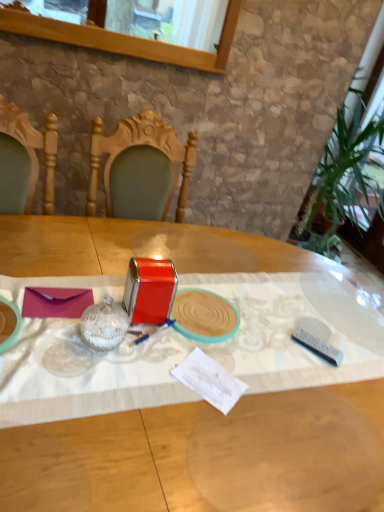
Identify the location of free area in between white plastic remote at lower right, the first tableware when ordered from right to left, and clear glass jar at center, acting as the 4th tableware starting from the right. (232, 353).